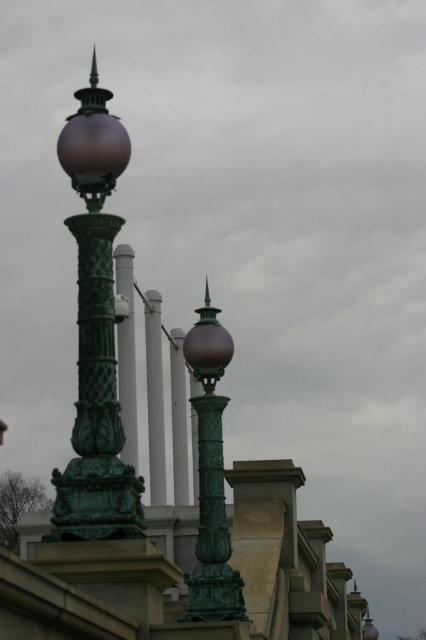
Question: Which object is closer to the camera taking this photo?

Choices:
 (A) green metal pole at center
 (B) green patinated metal street light at left

Answer: (B)

Question: Considering the real-world distances, which object is farthest from the green metal pole at center?

Choices:
 (A) green patinated metal street light at center
 (B) green patinated metal street light at left

Answer: (B)

Question: Observing the image, what is the correct spatial positioning of green patinated metal street light at center in reference to green metal pole at center?

Choices:
 (A) right
 (B) left

Answer: (A)

Question: Which object is farther from the camera taking this photo?

Choices:
 (A) green patinated metal street light at center
 (B) green metal pole at center

Answer: (B)

Question: Is the position of green patinated metal street light at center more distant than that of green metal pole at center?

Choices:
 (A) yes
 (B) no

Answer: (B)

Question: Is green patinated metal street light at left bigger than green patinated metal street light at center?

Choices:
 (A) no
 (B) yes

Answer: (A)